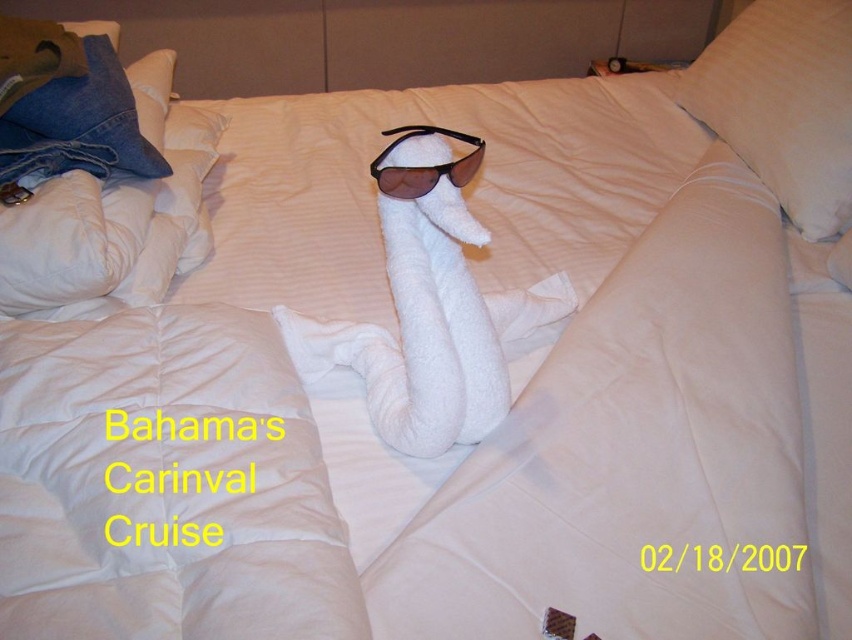
Which is in front, point (718, 68) or point (447, 177)?

Point (447, 177) is more forward.

Which is behind, point (767, 10) or point (459, 173)?

The point (767, 10) is behind.

Where is `white soft pillow at upper right`? The width and height of the screenshot is (852, 640). white soft pillow at upper right is located at coordinates (783, 104).

Is white soft pillow at upper right smaller than denim fabric pillow at upper left?

No, white soft pillow at upper right is not smaller than denim fabric pillow at upper left.

The height and width of the screenshot is (640, 852). What do you see at coordinates (783, 104) in the screenshot?
I see `white soft pillow at upper right` at bounding box center [783, 104].

Find the location of a particular element. Image resolution: width=852 pixels, height=640 pixels. white soft pillow at upper right is located at coordinates (783, 104).

You are a GUI agent. You are given a task and a screenshot of the screen. Output one action in this format:
    pyautogui.click(x=<x>, y=<y>)
    Task: Click on the white soft pillow at upper right
    The height and width of the screenshot is (640, 852).
    Given the screenshot: What is the action you would take?
    pyautogui.click(x=783, y=104)

Can you confirm if denim fabric pillow at upper left is smaller than dark brown plastic sunglasses at center?

Incorrect, denim fabric pillow at upper left is not smaller in size than dark brown plastic sunglasses at center.

Which is more to the right, denim fabric pillow at upper left or dark brown plastic sunglasses at center?

dark brown plastic sunglasses at center is more to the right.

Find the location of a particular element. This screenshot has height=640, width=852. denim fabric pillow at upper left is located at coordinates (78, 120).